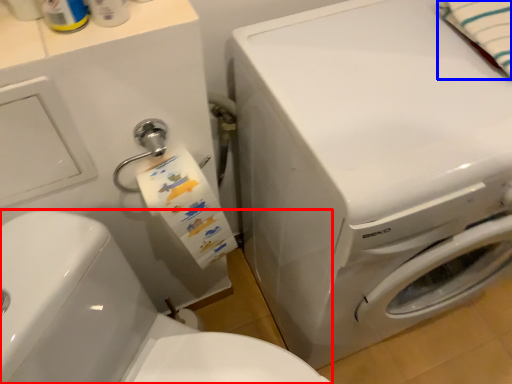
Question: Which point is further to the camera, washer (highlighted by a red box) or bath towel (highlighted by a blue box)?

Choices:
 (A) washer
 (B) bath towel

Answer: (B)